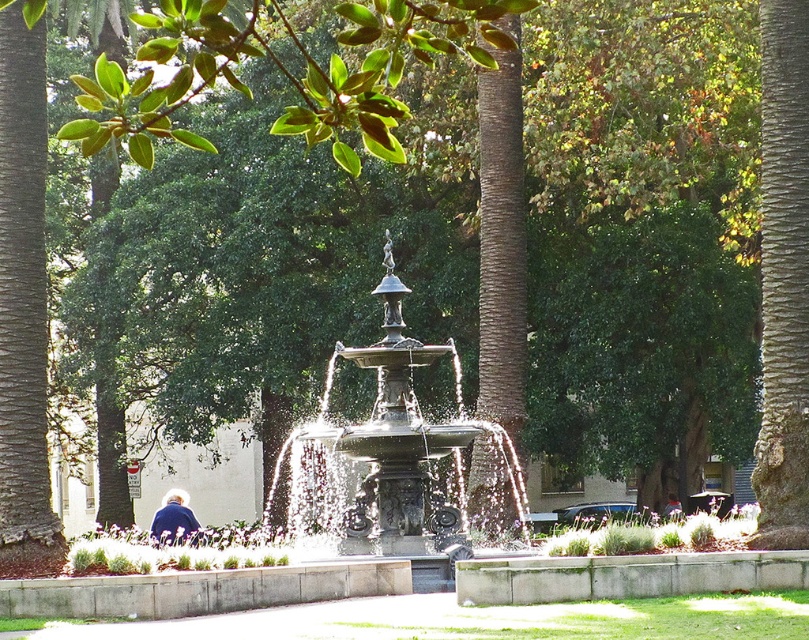
Question: Which point is closer to the camera?

Choices:
 (A) polished bronze fountain at center
 (B) brown rough bark tree at right

Answer: (B)

Question: Observing the image, what is the correct spatial positioning of brown rough bark tree at right in reference to blue fabric jacket at center?

Choices:
 (A) right
 (B) left

Answer: (B)

Question: Can you confirm if blue fabric jacket at lower left is wider than blue fabric jacket at center?

Choices:
 (A) no
 (B) yes

Answer: (B)

Question: Can you confirm if polished bronze fountain at center is bigger than blue fabric jacket at center?

Choices:
 (A) yes
 (B) no

Answer: (A)

Question: Which object appears closest to the camera in this image?

Choices:
 (A) brown rough bark tree at right
 (B) blue fabric jacket at lower left
 (C) blue fabric jacket at center

Answer: (A)

Question: Which of the following is the closest to the observer?

Choices:
 (A) brown rough bark tree at right
 (B) polished bronze fountain at center

Answer: (A)